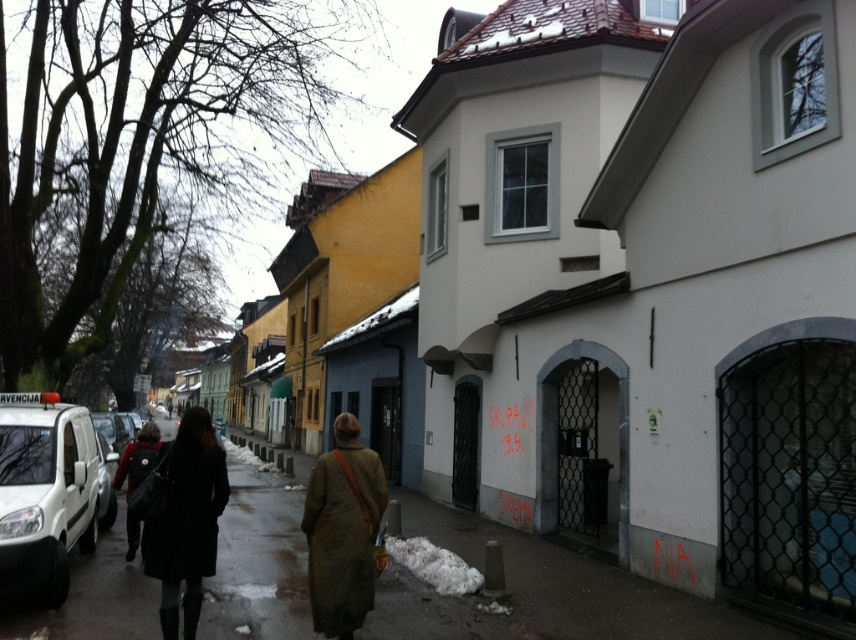
You are a pedestrian standing on the sidewalk and see the white matte van at left and the matte black coat at lower left. Which object is closer to your left side?

The matte black coat at lower left is closer to your left side because the white matte van at left is positioned to its right side.

You are standing at the point with coordinates (186, 522) in the image. What object is exactly at your current location?

The black matte coat at center is located at point (186, 522).